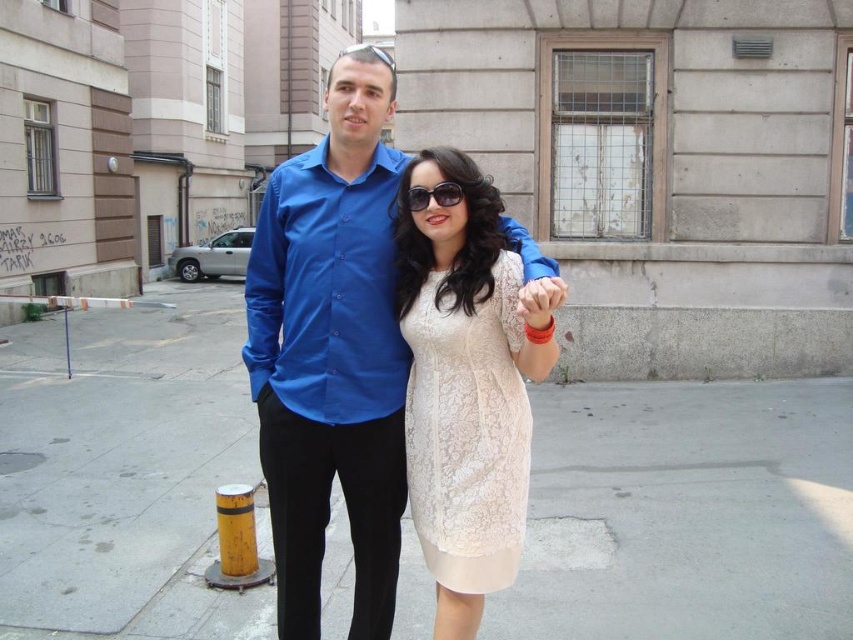
Question: Observing the image, what is the correct spatial positioning of blue cotton shirt at center in reference to lace fabric dress at center?

Choices:
 (A) above
 (B) below

Answer: (A)

Question: Is lace fabric dress at center below shiny black sunglasses at upper center?

Choices:
 (A) no
 (B) yes

Answer: (B)

Question: Which point is closer to the camera taking this photo?

Choices:
 (A) (502, 506)
 (B) (572, 561)

Answer: (A)

Question: Where is sunglasses at center located in relation to shiny black sunglasses at upper center in the image?

Choices:
 (A) left
 (B) right

Answer: (B)

Question: Considering the real-world distances, which object is closest to the blue cotton shirt at center?

Choices:
 (A) gray concrete pavement at center
 (B) lace fabric dress at center
 (C) shiny black sunglasses at upper center
 (D) sunglasses at center

Answer: (D)

Question: Which point is closer to the camera taking this photo?

Choices:
 (A) (358, 400)
 (B) (175, 451)
 (C) (459, 195)
 (D) (393, 67)

Answer: (C)